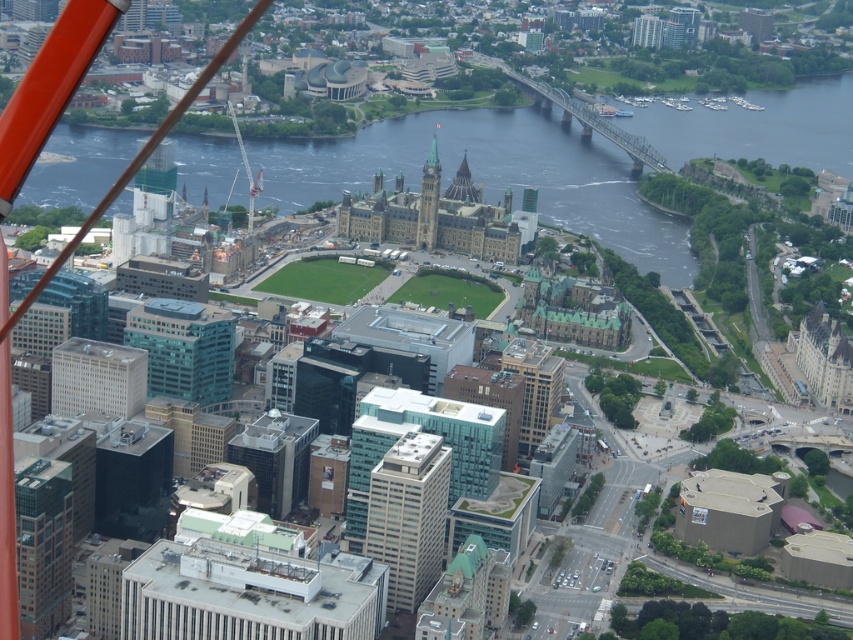
Is beige concrete building at center bigger than white smooth building at center-left?

Correct, beige concrete building at center is larger in size than white smooth building at center-left.

Does beige concrete building at center have a smaller size compared to white smooth building at center-left?

No.

I want to click on beige concrete building at center, so click(408, 515).

Locate an element on the screen. beige concrete building at center is located at coordinates (408, 515).

Based on the photo, can you confirm if beige concrete building at center is smaller than glassy teal skyscraper at center-left?

Actually, beige concrete building at center might be larger than glassy teal skyscraper at center-left.

Between point (404, 563) and point (207, 336), which one is positioned behind?

Point (207, 336)

What are the coordinates of `beige concrete building at center` in the screenshot? It's located at (408, 515).

Image resolution: width=853 pixels, height=640 pixels. Find the location of `beige concrete building at center`. beige concrete building at center is located at coordinates (408, 515).

From the picture: Does glassy teal skyscraper at center-left have a greater width compared to gold glass skyscraper at center?

Correct, the width of glassy teal skyscraper at center-left exceeds that of gold glass skyscraper at center.

Which of these two, glassy teal skyscraper at center-left or gold glass skyscraper at center, stands taller?

gold glass skyscraper at center is taller.

Which is in front, point (173, 342) or point (561, 378)?

Positioned in front is point (561, 378).

You are a GUI agent. You are given a task and a screenshot of the screen. Output one action in this format:
    pyautogui.click(x=<x>, y=<y>)
    Task: Click on the glassy teal skyscraper at center-left
    This screenshot has height=640, width=853.
    Given the screenshot: What is the action you would take?
    pyautogui.click(x=183, y=348)